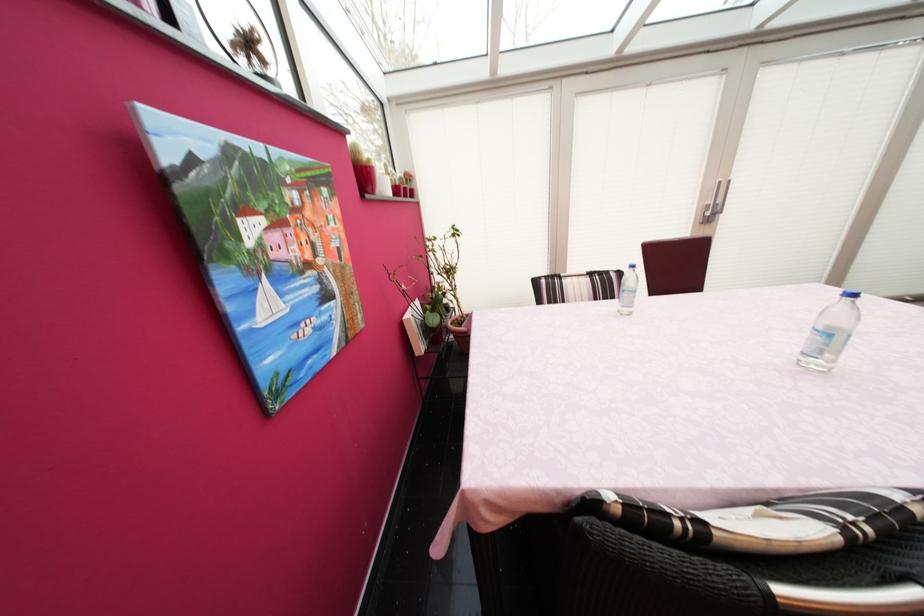
What do you see at coordinates (715, 201) in the screenshot? The width and height of the screenshot is (924, 616). I see `the silver window handle` at bounding box center [715, 201].